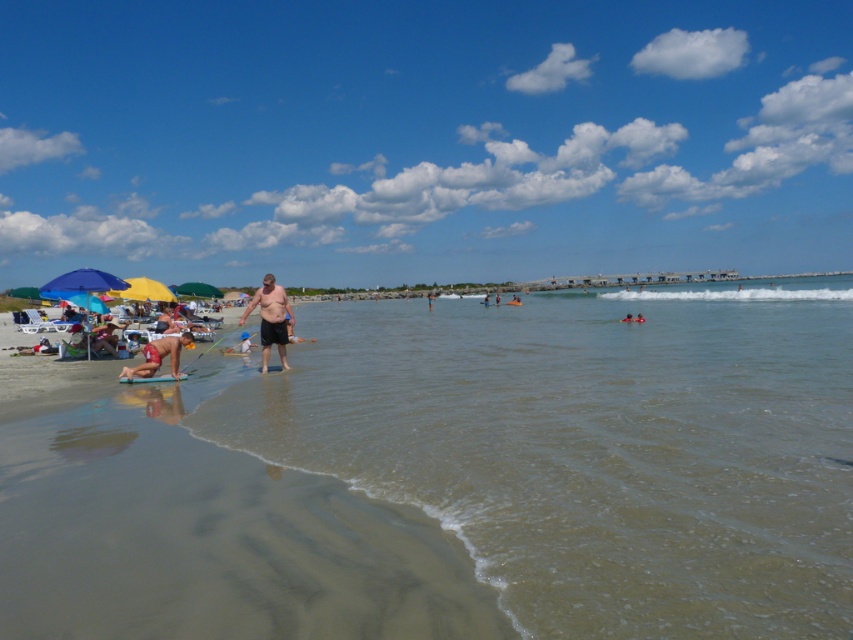
Question: Does reddish-brown skin at lower left have a greater width compared to smooth skin person at lower center?

Choices:
 (A) yes
 (B) no

Answer: (A)

Question: Is reddish-brown skin at lower left bigger than yellow fabric umbrella at upper left?

Choices:
 (A) no
 (B) yes

Answer: (A)

Question: Which point appears closest to the camera in this image?

Choices:
 (A) (625, 316)
 (B) (135, 282)

Answer: (B)

Question: Based on their relative distances, which object is farther from the dark brown shorts at center?

Choices:
 (A) clear water at center
 (B) blue sky at upper center
 (C) smooth skin person at lower center
 (D) yellow fabric umbrella at upper left

Answer: (B)

Question: Is yellow fabric umbrella at upper left positioned before smooth skin person at lower center?

Choices:
 (A) yes
 (B) no

Answer: (A)

Question: Among these objects, which one is farthest from the camera?

Choices:
 (A) reddish-brown skin at lower left
 (B) clear water at center
 (C) dark brown shorts at center

Answer: (C)